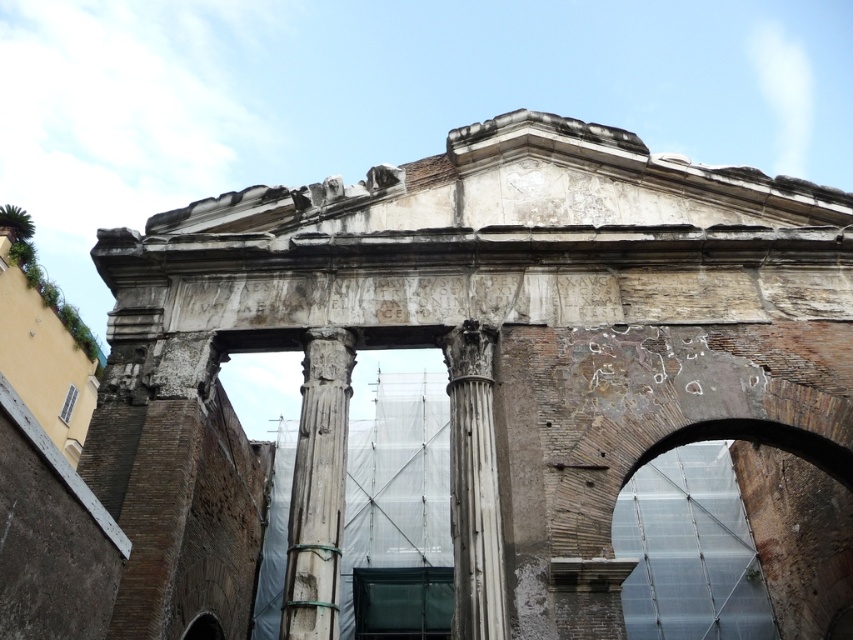
You are an architect examining the ancient structure. You notice the rusty metal arch at center and the white marble column at center. Which object has a greater height?

The rusty metal arch at center is taller than the white marble column at center, so the rusty metal arch at center has a greater height.

You are an archaeologist examining the ancient structure. You notice the rusty metal arch at center and the white stone column at center. Which object is positioned to the right of the other?

The rusty metal arch at center is to the right of the white stone column at center.

You are an archaeologist examining the ancient Roman temple structure. You notice two points marked on the columns. The first point is at coordinates point (317, 419) and the second at point (474, 336). Which point is closer to your current position as you stand in front of the structure?

Point (317, 419) is closer to the viewer than point (474, 336), so the first point is closer to your current position.